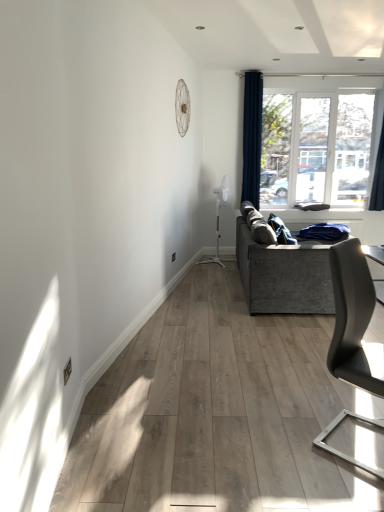
Question: Should I look upward or downward to see matte gray chair at right?

Choices:
 (A) up
 (B) down

Answer: (B)

Question: Is textured gray couch at right located outside dark blue fabric curtain at upper right, arranged as the first curtain when viewed from the left?

Choices:
 (A) no
 (B) yes

Answer: (B)

Question: Considering the relative sizes of textured gray couch at right and dark blue fabric curtain at upper right, arranged as the first curtain when viewed from the left, in the image provided, is textured gray couch at right thinner than dark blue fabric curtain at upper right, arranged as the first curtain when viewed from the left,?

Choices:
 (A) no
 (B) yes

Answer: (A)

Question: Does textured gray couch at right contain dark blue fabric curtain at upper right, arranged as the first curtain when viewed from the left?

Choices:
 (A) yes
 (B) no

Answer: (B)

Question: Is textured gray couch at right next to dark blue fabric curtain at upper right, arranged as the first curtain when viewed from the left, and touching it?

Choices:
 (A) no
 (B) yes

Answer: (A)

Question: Is textured gray couch at right facing towards dark blue fabric curtain at upper right, arranged as the first curtain when viewed from the left?

Choices:
 (A) no
 (B) yes

Answer: (A)

Question: From the image's perspective, does textured gray couch at right appear lower than dark blue fabric curtain at upper right, which ranks as the second curtain in right-to-left order?

Choices:
 (A) yes
 (B) no

Answer: (A)

Question: Does textured gray couch at right have a smaller size compared to matte gray chair at right?

Choices:
 (A) yes
 (B) no

Answer: (B)

Question: Are textured gray couch at right and matte gray chair at right located far from each other?

Choices:
 (A) yes
 (B) no

Answer: (A)

Question: Could you tell me if textured gray couch at right is turned towards matte gray chair at right?

Choices:
 (A) yes
 (B) no

Answer: (B)

Question: Is textured gray couch at right oriented away from matte gray chair at right?

Choices:
 (A) yes
 (B) no

Answer: (B)

Question: From a real-world perspective, does textured gray couch at right sit lower than matte gray chair at right?

Choices:
 (A) no
 (B) yes

Answer: (B)

Question: Considering the relative sizes of textured gray couch at right and matte gray chair at right in the image provided, is textured gray couch at right wider than matte gray chair at right?

Choices:
 (A) no
 (B) yes

Answer: (B)

Question: Is dark blue fabric curtain at upper right, placed as the first curtain when sorted from right to left, located outside textured gray couch at right?

Choices:
 (A) no
 (B) yes

Answer: (B)